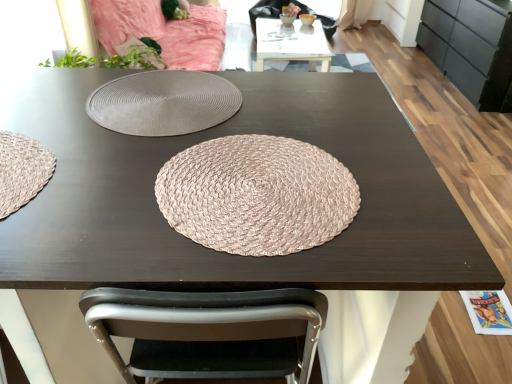
Question: Considering the relative sizes of white glossy table at upper center and pink woven mat at center in the image provided, is white glossy table at upper center wider than pink woven mat at center?

Choices:
 (A) no
 (B) yes

Answer: (B)

Question: Is the depth of white glossy table at upper center greater than that of pink woven mat at center?

Choices:
 (A) yes
 (B) no

Answer: (A)

Question: Considering the relative sizes of white glossy table at upper center and pink woven mat at center in the image provided, is white glossy table at upper center shorter than pink woven mat at center?

Choices:
 (A) yes
 (B) no

Answer: (B)

Question: Is white glossy table at upper center smaller than pink woven mat at center?

Choices:
 (A) yes
 (B) no

Answer: (B)

Question: From the image's perspective, would you say white glossy table at upper center is shown under pink woven mat at center?

Choices:
 (A) no
 (B) yes

Answer: (A)

Question: Considering the relative positions of pink woven mat at center and white glossy table at upper center in the image provided, is pink woven mat at center to the left or to the right of white glossy table at upper center?

Choices:
 (A) left
 (B) right

Answer: (A)

Question: Is pink woven mat at center inside the boundaries of white glossy table at upper center, or outside?

Choices:
 (A) outside
 (B) inside

Answer: (A)

Question: Is pink woven mat at center taller or shorter than white glossy table at upper center?

Choices:
 (A) short
 (B) tall

Answer: (A)

Question: Is point (286, 173) positioned closer to the camera than point (287, 59)?

Choices:
 (A) farther
 (B) closer

Answer: (B)

Question: From a real-world perspective, is matte black dresser at right above or below matte gray placemat at center?

Choices:
 (A) above
 (B) below

Answer: (B)

Question: Is point (470, 87) closer or farther from the camera than point (176, 97)?

Choices:
 (A) closer
 (B) farther

Answer: (B)

Question: Considering the positions of matte black dresser at right and matte gray placemat at center in the image, is matte black dresser at right bigger or smaller than matte gray placemat at center?

Choices:
 (A) small
 (B) big

Answer: (B)

Question: Considering the positions of matte black dresser at right and matte gray placemat at center in the image, is matte black dresser at right wider or thinner than matte gray placemat at center?

Choices:
 (A) thin
 (B) wide

Answer: (B)

Question: From a real-world perspective, is white glossy table at upper center physically located above or below pink woven mat at center?

Choices:
 (A) below
 (B) above

Answer: (A)

Question: Looking at their shapes, would you say white glossy table at upper center is wider or thinner than pink woven mat at center?

Choices:
 (A) wide
 (B) thin

Answer: (A)